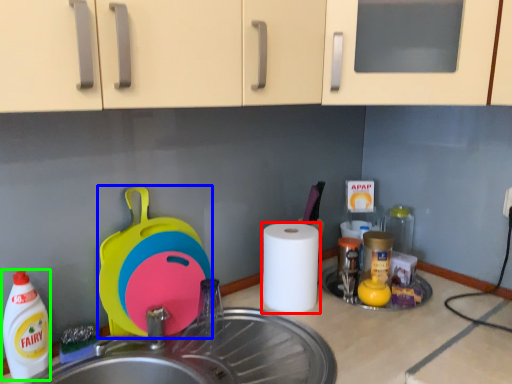
Question: Considering the real-world distances, which object is farthest from paper towel (highlighted by a red box)? appliance (highlighted by a blue box) or cleaning product (highlighted by a green box)?

Choices:
 (A) appliance
 (B) cleaning product

Answer: (B)